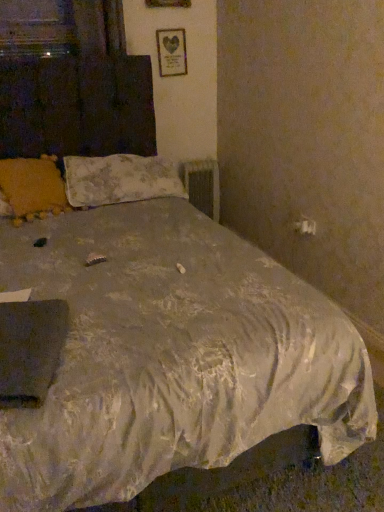
Question: In the image, is floral fabric pillow at upper left, arranged as the first pillow when viewed from the right, on the left side or the right side of yellow fabric pillow at upper left, which ranks as the first pillow in left-to-right order?

Choices:
 (A) right
 (B) left

Answer: (A)

Question: From a real-world perspective, is floral fabric pillow at upper left, which is the 2th pillow from left to right, positioned above or below yellow fabric pillow at upper left, acting as the second pillow starting from the right?

Choices:
 (A) above
 (B) below

Answer: (B)

Question: Which is farther from the wooden frame with heart print at upper center?

Choices:
 (A) floral fabric pillow at upper left, arranged as the first pillow when viewed from the right
 (B) metallic silver radiator at center
 (C) yellow fabric pillow at upper left, acting as the second pillow starting from the right

Answer: (C)

Question: Considering the real-world distances, which object is closest to the metallic silver radiator at center?

Choices:
 (A) wooden frame with heart print at upper center
 (B) yellow fabric pillow at upper left, acting as the second pillow starting from the right
 (C) floral fabric pillow at upper left, which is the 2th pillow from left to right

Answer: (A)